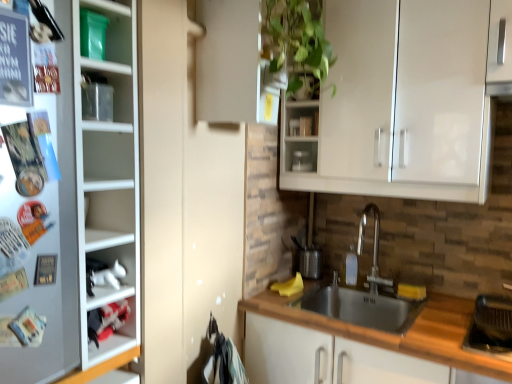
Measure the distance between metallic silver cupboard at left and camera.

86.10 centimeters.

What is the approximate width of metallic silver cupboard at left?

The width of metallic silver cupboard at left is 2.98 inches.

Image resolution: width=512 pixels, height=384 pixels. In order to click on white glossy cabinet at upper center in this screenshot , I will do `click(234, 65)`.

What is the approximate width of polished stainless steel faucet at center?

polished stainless steel faucet at center is 11.65 inches in width.

Describe the element at coordinates (373, 249) in the screenshot. The width and height of the screenshot is (512, 384). I see `polished stainless steel faucet at center` at that location.

Find the location of a particular element. The height and width of the screenshot is (384, 512). green matte plant at upper center is located at coordinates (304, 88).

What do you see at coordinates (111, 324) in the screenshot? This screenshot has width=512, height=384. I see `white plastic cabinet at lower left, arranged as the 1th cabinet when ordered from the bottom` at bounding box center [111, 324].

The image size is (512, 384). I want to click on white glossy cabinet at lower left, which is counted as the first cabinet, starting from the top, so click(x=113, y=275).

Image resolution: width=512 pixels, height=384 pixels. What do you see at coordinates (362, 307) in the screenshot?
I see `stainless steel sink at lower center` at bounding box center [362, 307].

Find the location of a particular element. The height and width of the screenshot is (384, 512). metallic silver cupboard at left is located at coordinates (71, 209).

Is metallic silver container at upper center to the right of white plastic cabinet at lower left, arranged as the 1th cabinet when ordered from the bottom, from the viewer's perspective?

Indeed, metallic silver container at upper center is positioned on the right side of white plastic cabinet at lower left, arranged as the 1th cabinet when ordered from the bottom.

Could you tell me if metallic silver container at upper center is turned towards white plastic cabinet at lower left, acting as the 2th cabinet starting from the top?

Yes, metallic silver container at upper center faces towards white plastic cabinet at lower left, acting as the 2th cabinet starting from the top.

Would you say metallic silver container at upper center is outside white plastic cabinet at lower left, arranged as the 1th cabinet when ordered from the bottom?

metallic silver container at upper center is positioned outside white plastic cabinet at lower left, arranged as the 1th cabinet when ordered from the bottom.

Looking at their sizes, would you say metallic silver container at upper center is wider or thinner than white plastic cabinet at lower left, acting as the 2th cabinet starting from the top?

Considering their sizes, metallic silver container at upper center looks slimmer than white plastic cabinet at lower left, acting as the 2th cabinet starting from the top.

Who is shorter, metallic silver container at upper center or polished stainless steel faucet at center?

With less height is metallic silver container at upper center.

Considering the points (301, 154) and (364, 208), which point is in front, point (301, 154) or point (364, 208)?

The point (301, 154) is in front.

Identify the location of appliance above the polished stainless steel faucet at center (from a real-world perspective). This screenshot has height=384, width=512. (301, 161).

Consider the image. Which point is more distant from viewer, (285, 79) or (81, 228)?

The point (285, 79) is farther.

I want to click on cabinetry that appears above the metallic silver cupboard at left (from a real-world perspective), so click(x=234, y=65).

Is white glossy cabinet at upper center touching metallic silver cupboard at left?

white glossy cabinet at upper center is not next to metallic silver cupboard at left, and they're not touching.

Does white glossy cabinet at upper center turn towards metallic silver cupboard at left?

No, white glossy cabinet at upper center is not aimed at metallic silver cupboard at left.

From the picture: Is white glossy cabinet at lower left, the 2th cabinet positioned from the bottom, in front of or behind polished stainless steel faucet at center in the image?

Visually, white glossy cabinet at lower left, the 2th cabinet positioned from the bottom, is located in front of polished stainless steel faucet at center.

In order to click on cabinet that is the 1st one when counting leftward from the polished stainless steel faucet at center in this screenshot , I will do `click(113, 275)`.

Is polished stainless steel faucet at center at the back of white glossy cabinet at lower left, which is counted as the first cabinet, starting from the top?

white glossy cabinet at lower left, which is counted as the first cabinet, starting from the top, does not have its back to polished stainless steel faucet at center.

From the image's perspective, which is above, white glossy cabinet at lower left, the 2th cabinet positioned from the bottom, or polished stainless steel faucet at center?

white glossy cabinet at lower left, the 2th cabinet positioned from the bottom, from the image's perspective.

Identify the location of shelf lying on the left of stainless steel sink at lower center. (304, 88).

Which object is closer to the camera, stainless steel sink at lower center or green matte plant at upper center?

stainless steel sink at lower center.

Consider the image. Is green matte plant at upper center completely or partially inside stainless steel sink at lower center?

No, green matte plant at upper center is not surrounded by stainless steel sink at lower center.

Is stainless steel sink at lower center aimed at green matte plant at upper center?

No, stainless steel sink at lower center does not turn towards green matte plant at upper center.

Considering the positions of objects metallic silver cupboard at left and white plastic cabinet at lower left, arranged as the 1th cabinet when ordered from the bottom, in the image provided, who is in front, metallic silver cupboard at left or white plastic cabinet at lower left, arranged as the 1th cabinet when ordered from the bottom,?

metallic silver cupboard at left.

Considering the sizes of objects metallic silver cupboard at left and white plastic cabinet at lower left, arranged as the 1th cabinet when ordered from the bottom, in the image provided, who is bigger, metallic silver cupboard at left or white plastic cabinet at lower left, arranged as the 1th cabinet when ordered from the bottom,?

Bigger between the two is metallic silver cupboard at left.

From the image's perspective, which one is positioned lower, metallic silver cupboard at left or white plastic cabinet at lower left, acting as the 2th cabinet starting from the top?

From the image's view, white plastic cabinet at lower left, acting as the 2th cabinet starting from the top, is below.

Who is bigger, stainless steel sink at lower center or white glossy cabinet at lower left, the 2th cabinet positioned from the bottom?

Bigger between the two is stainless steel sink at lower center.

Is stainless steel sink at lower center touching white glossy cabinet at lower left, the 2th cabinet positioned from the bottom?

stainless steel sink at lower center is not next to white glossy cabinet at lower left, the 2th cabinet positioned from the bottom, and they're not touching.

Is stainless steel sink at lower center facing towards white glossy cabinet at lower left, which is counted as the first cabinet, starting from the top?

No.

Between stainless steel sink at lower center and white glossy cabinet at lower left, the 2th cabinet positioned from the bottom, which one is positioned in front?

white glossy cabinet at lower left, the 2th cabinet positioned from the bottom, is closer to the camera.

Where is `the 2nd cabinet positioned below the metallic silver container at upper center (from a real-world perspective)`? The height and width of the screenshot is (384, 512). the 2nd cabinet positioned below the metallic silver container at upper center (from a real-world perspective) is located at coordinates (111, 324).

You are a GUI agent. You are given a task and a screenshot of the screen. Output one action in this format:
    pyautogui.click(x=<x>, y=<y>)
    Task: Click on the tap that appears in front of the metallic silver container at upper center
    Image resolution: width=512 pixels, height=384 pixels.
    Given the screenshot: What is the action you would take?
    pyautogui.click(x=373, y=249)

When comparing their distances from metallic silver container at upper center, does white glossy cabinet at lower left, which is counted as the first cabinet, starting from the top, or white plastic cabinet at lower left, arranged as the 1th cabinet when ordered from the bottom, seem further?

The object further to metallic silver container at upper center is white plastic cabinet at lower left, arranged as the 1th cabinet when ordered from the bottom.

Considering their positions, is metallic silver cupboard at left positioned further to green matte plant at upper center than polished stainless steel faucet at center?

metallic silver cupboard at left is positioned further to the anchor green matte plant at upper center.

When comparing their distances from white glossy cabinet at lower left, the 2th cabinet positioned from the bottom, does white glossy cabinet at upper center or stainless steel sink at lower center seem closer?

white glossy cabinet at upper center lies closer to white glossy cabinet at lower left, the 2th cabinet positioned from the bottom, than the other object.

Looking at the image, which one is located further to green matte plant at upper center, white glossy cabinet at upper center or stainless steel sink at lower center?

stainless steel sink at lower center is further to green matte plant at upper center.

From the image, which object appears to be farther from green matte plant at upper center, stainless steel sink at lower center or metallic silver container at upper center?

stainless steel sink at lower center lies further to green matte plant at upper center than the other object.

When comparing their distances from white plastic cabinet at lower left, arranged as the 1th cabinet when ordered from the bottom, does polished stainless steel faucet at center or white glossy cabinet at lower left, the 2th cabinet positioned from the bottom, seem closer?

The object closer to white plastic cabinet at lower left, arranged as the 1th cabinet when ordered from the bottom, is white glossy cabinet at lower left, the 2th cabinet positioned from the bottom.

Estimate the real-world distances between objects in this image. Which object is further from white glossy cabinet at lower left, the 2th cabinet positioned from the bottom, stainless steel sink at lower center or green matte plant at upper center?

green matte plant at upper center lies further to white glossy cabinet at lower left, the 2th cabinet positioned from the bottom, than the other object.

Looking at the image, which one is located further to white plastic cabinet at lower left, arranged as the 1th cabinet when ordered from the bottom, green matte plant at upper center or white glossy cabinet at upper center?

green matte plant at upper center lies further to white plastic cabinet at lower left, arranged as the 1th cabinet when ordered from the bottom, than the other object.

The width and height of the screenshot is (512, 384). What are the coordinates of `appliance located between white plastic cabinet at lower left, acting as the 2th cabinet starting from the top, and polished stainless steel faucet at center in the left-right direction` in the screenshot? It's located at (301, 161).

Find the location of a particular element. Image resolution: width=512 pixels, height=384 pixels. shelf between white plastic cabinet at lower left, acting as the 2th cabinet starting from the top, and polished stainless steel faucet at center, in the horizontal direction is located at coordinates (304, 88).

The width and height of the screenshot is (512, 384). Identify the location of tap between white glossy cabinet at upper center and stainless steel sink at lower center in the vertical direction. (373, 249).

Where is `cupboard between white glossy cabinet at upper center and white glossy cabinet at lower left, which is counted as the first cabinet, starting from the top, in the up-down direction`? cupboard between white glossy cabinet at upper center and white glossy cabinet at lower left, which is counted as the first cabinet, starting from the top, in the up-down direction is located at coordinates (71, 209).